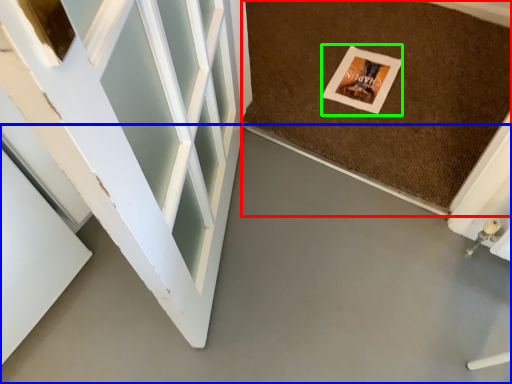
Question: Which is farther away from mat (highlighted by a red box)? concrete (highlighted by a blue box) or postcard (highlighted by a green box)?

Choices:
 (A) concrete
 (B) postcard

Answer: (A)